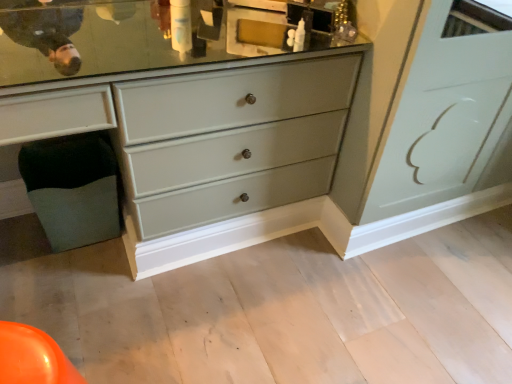
This screenshot has height=384, width=512. Find the location of `unoccupied region to the right of satin gray dresser at center`. unoccupied region to the right of satin gray dresser at center is located at coordinates (352, 297).